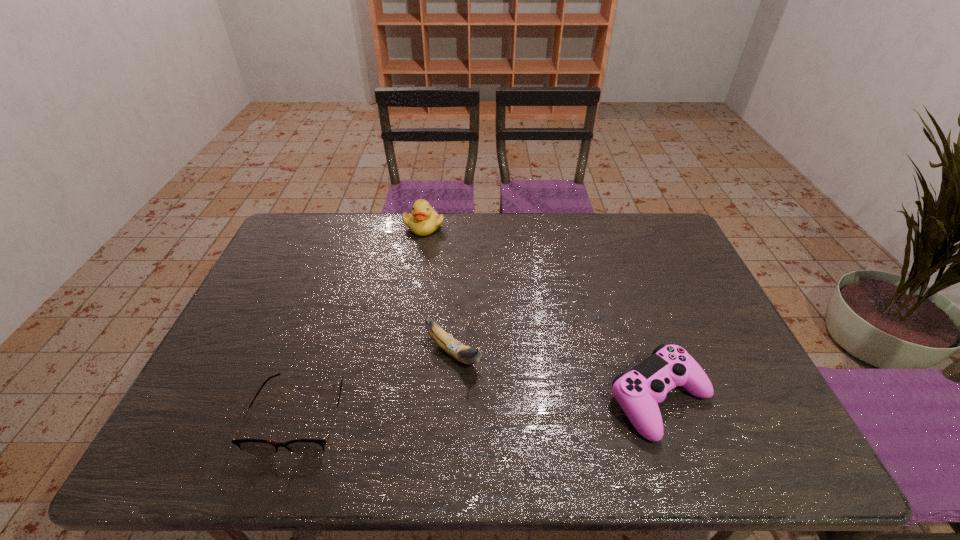
In the image, there is a desktop. In order to click on vacant space at the left edge in this screenshot , I will do `click(278, 329)`.

This screenshot has width=960, height=540. Find the location of `vacant space at the right edge of the desktop`. vacant space at the right edge of the desktop is located at coordinates (733, 373).

This screenshot has height=540, width=960. In order to click on vacant region between the banana and the spectacles in this screenshot , I will do [377, 384].

You are a GUI agent. You are given a task and a screenshot of the screen. Output one action in this format:
    pyautogui.click(x=<x>, y=<y>)
    Task: Click on the empty location between the banana and the rightmost object
    The image size is (960, 540).
    Given the screenshot: What is the action you would take?
    pyautogui.click(x=556, y=377)

At what (x,y) coordinates should I click in order to perform the action: click on vacant space in between the spectacles and the third tallest object. Please return your answer as a coordinate pair (x, y). The width and height of the screenshot is (960, 540). Looking at the image, I should click on (480, 407).

The image size is (960, 540). In order to click on blank region between the spectacles and the banana in this screenshot , I will do `click(377, 384)`.

I want to click on vacant space that's between the shortest object and the rightmost object, so click(480, 407).

Image resolution: width=960 pixels, height=540 pixels. What are the coordinates of `vacant point located between the second shortest object and the duckling` in the screenshot? It's located at (541, 313).

Where is `vacant area between the control and the duckling`? This screenshot has width=960, height=540. vacant area between the control and the duckling is located at coordinates (541, 313).

The height and width of the screenshot is (540, 960). In order to click on free spot between the control and the banana in this screenshot , I will do pos(556,377).